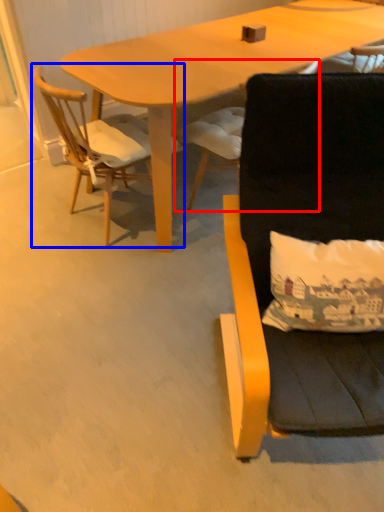
Question: Which object appears farthest to the camera in this image, chair (highlighted by a red box) or chair (highlighted by a blue box)?

Choices:
 (A) chair
 (B) chair

Answer: (A)